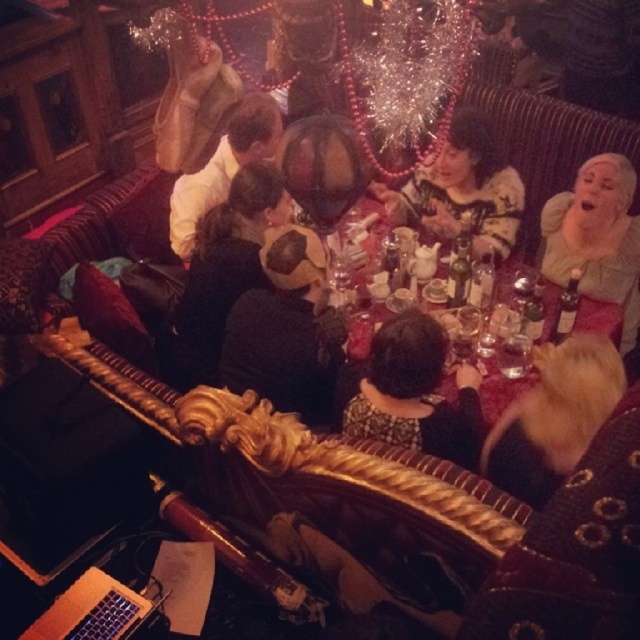
You are sitting at the matte black table at center and want to reach for the black velvet hat at center. In which direction should you look to find it?

The black velvet hat at center is to the left of the matte black table at center, so you should look to your left to find it.

From the picture: You are a guest at this festive gathering and want to place your black velvet hat at center on the table. Can you place it on the matte black table at center without moving anything else?

The black velvet hat at center is already positioned under matte black table at center, so it is already placed on the table. There is no need to move anything else.